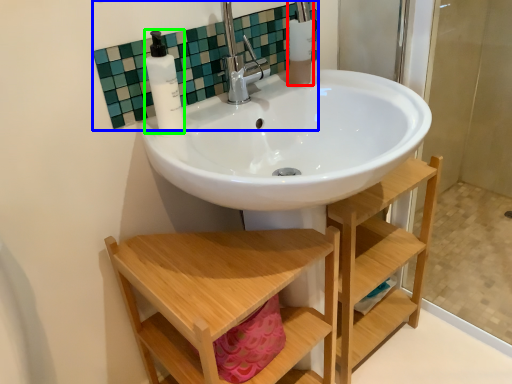
Question: Which object is positioned closest to toiletry (highlighted by a red box)? Select from mirror (highlighted by a blue box) and soap dispenser (highlighted by a green box).

Choices:
 (A) mirror
 (B) soap dispenser

Answer: (A)